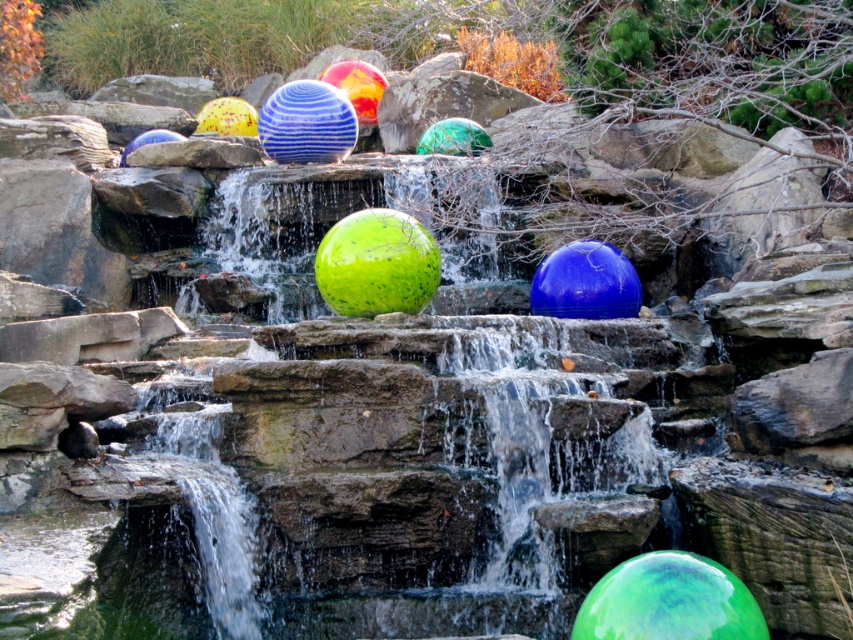
Question: Is translucent multicolored sphere at center to the right of matte blue ball at upper left from the viewer's perspective?

Choices:
 (A) no
 (B) yes

Answer: (B)

Question: Is glossy blue sphere at center closer to camera compared to yellow matte beach ball at upper left?

Choices:
 (A) no
 (B) yes

Answer: (B)

Question: Which point is farther to the camera?

Choices:
 (A) [386, 308]
 (B) [241, 128]
 (C) [125, 154]

Answer: (B)

Question: Estimate the real-world distances between objects in this image. Which object is farther from the glossy blue sphere at center?

Choices:
 (A) translucent green sphere at center
 (B) blue striped sphere at center
 (C) yellow matte beach ball at upper left
 (D) green glossy sphere at center

Answer: (C)

Question: Is glossy blue sphere at center to the left of yellow matte beach ball at upper left from the viewer's perspective?

Choices:
 (A) no
 (B) yes

Answer: (A)

Question: Which is farther from the translucent green sphere at center?

Choices:
 (A) green glossy sphere at center
 (B) blue striped sphere at center
 (C) green speckled sphere at center

Answer: (A)